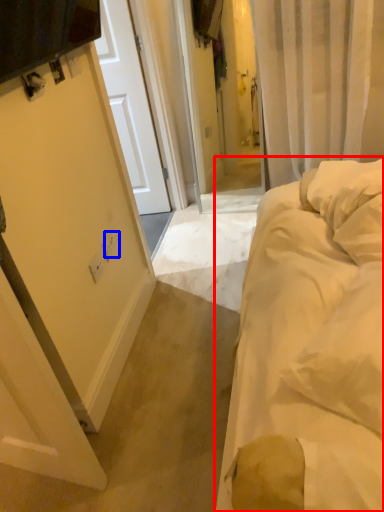
Question: Which point is closer to the camera, bed (highlighted by a red box) or electric outlet (highlighted by a blue box)?

Choices:
 (A) bed
 (B) electric outlet

Answer: (A)